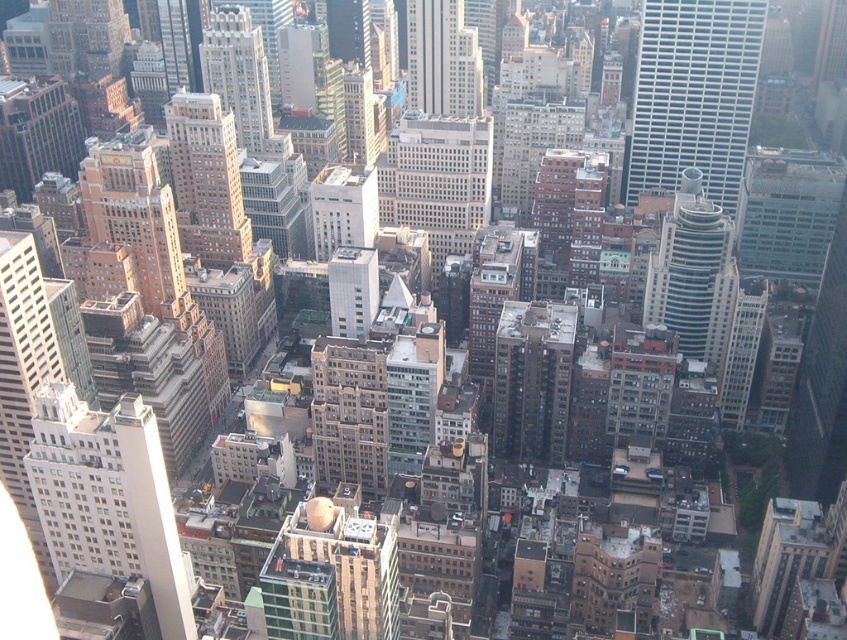
Question: Is white smooth building at center-left further to camera compared to green glass tower at center-right?

Choices:
 (A) no
 (B) yes

Answer: (A)

Question: Considering the relative positions of white smooth building at center-left and white glass skyscraper at upper right in the image provided, where is white smooth building at center-left located with respect to white glass skyscraper at upper right?

Choices:
 (A) below
 (B) above

Answer: (A)

Question: Estimate the real-world distances between objects in this image. Which object is farther from the white glass skyscraper at upper right?

Choices:
 (A) green glass tower at center-right
 (B) white smooth building at center-left

Answer: (B)

Question: Is green glass tower at center-right positioned at the back of smooth glass skyscraper at center?

Choices:
 (A) yes
 (B) no

Answer: (A)

Question: Which point is closer to the camera?

Choices:
 (A) white smooth building at center-left
 (B) smooth glass skyscraper at center

Answer: (A)

Question: Considering the real-world distances, which object is closest to the green glass tower at center-right?

Choices:
 (A) brown brick building at center
 (B) white glass skyscraper at upper right

Answer: (B)